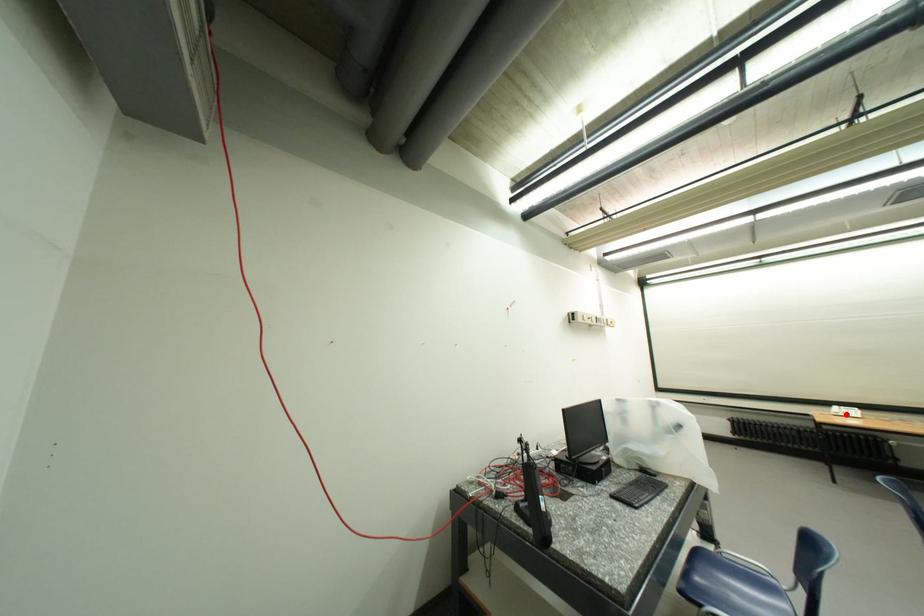
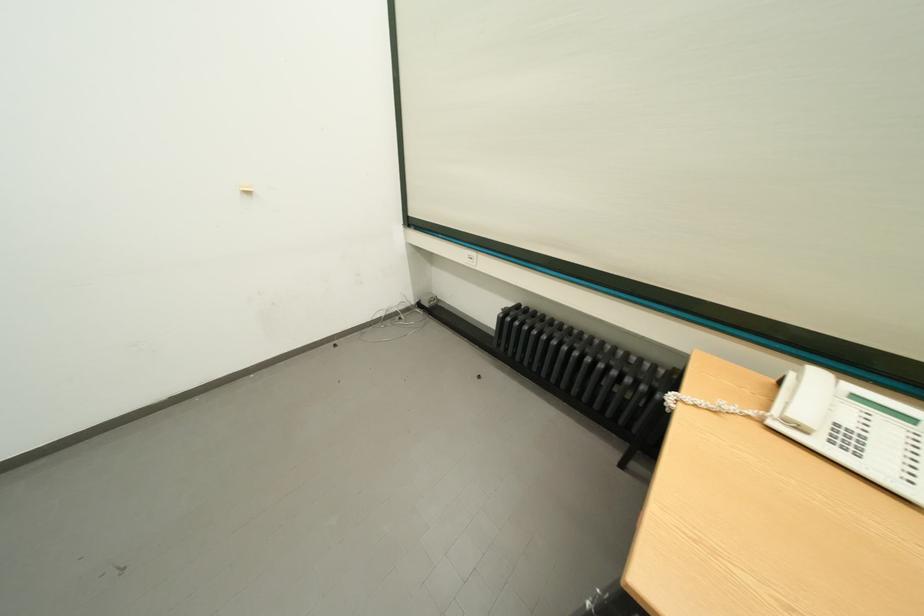
Question: I am providing you with two images of the same scene from different viewpoints. In image1, a red point is highlighted. Considering the same 3D point in image2, which of the following is correct?

Choices:
 (A) It is closer
 (B) It is farther

Answer: (B)